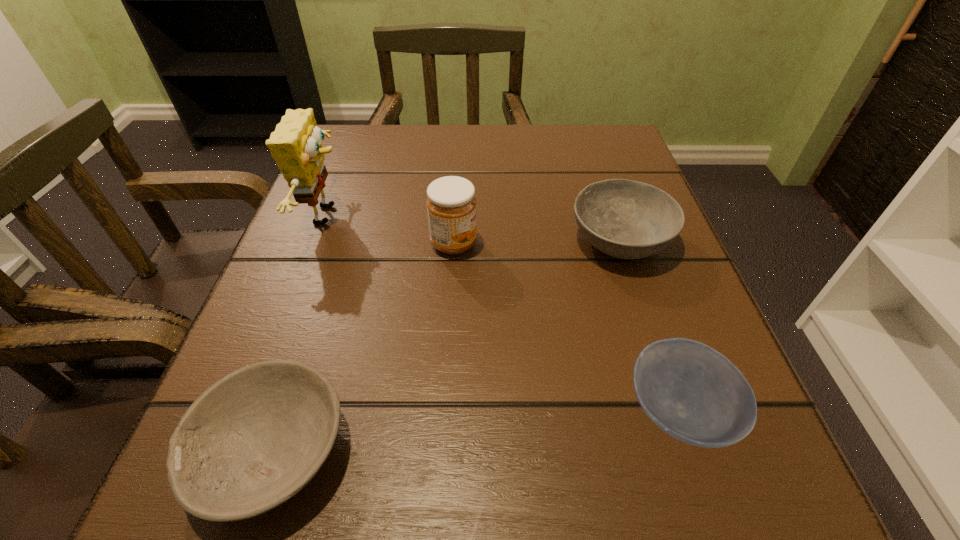
The width and height of the screenshot is (960, 540). I want to click on bowl that can be found as the closest to the tallest object, so click(x=251, y=441).

The height and width of the screenshot is (540, 960). Find the location of `free space in the image that satisfies the following two spatial constraints: 1. on the face of the sponge; 2. on the right side of the farthest bowl`. free space in the image that satisfies the following two spatial constraints: 1. on the face of the sponge; 2. on the right side of the farthest bowl is located at coordinates (319, 241).

This screenshot has width=960, height=540. I want to click on vacant region that satisfies the following two spatial constraints: 1. on the face of the farthest bowl; 2. on the right side of the sponge, so click(319, 241).

Where is `vacant area in the image that satisfies the following two spatial constraints: 1. on the face of the tallest object; 2. on the right side of the farthest bowl`? The image size is (960, 540). vacant area in the image that satisfies the following two spatial constraints: 1. on the face of the tallest object; 2. on the right side of the farthest bowl is located at coordinates (319, 241).

Where is `vacant region that satisfies the following two spatial constraints: 1. on the front side of the farthest bowl; 2. on the front label of the third object from right to left`? This screenshot has width=960, height=540. vacant region that satisfies the following two spatial constraints: 1. on the front side of the farthest bowl; 2. on the front label of the third object from right to left is located at coordinates (621, 244).

The height and width of the screenshot is (540, 960). Identify the location of free spot that satisfies the following two spatial constraints: 1. on the back side of the leftmost bowl; 2. on the face of the tallest object. (349, 215).

Find the location of `blank space that satisfies the following two spatial constraints: 1. on the face of the sponge; 2. on the back side of the farthest bowl`. blank space that satisfies the following two spatial constraints: 1. on the face of the sponge; 2. on the back side of the farthest bowl is located at coordinates (319, 241).